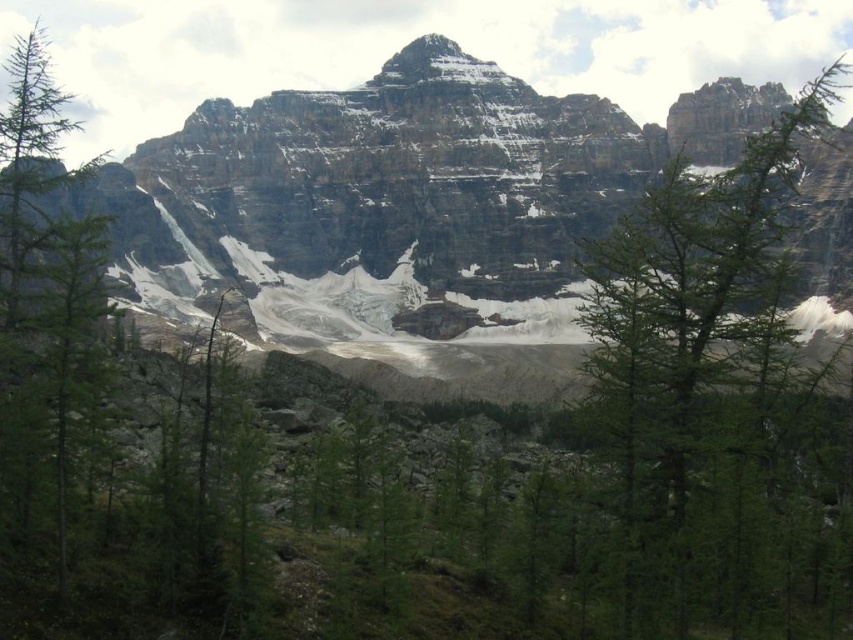
You are a hiker trying to reach the summit of the rocky mountain at center. You notice a green matte tree at left in your path. Can you walk directly towards the summit without going around the tree?

The green matte tree at left is behind the rocky mountain at center, so you can walk directly towards the summit without needing to go around the tree.